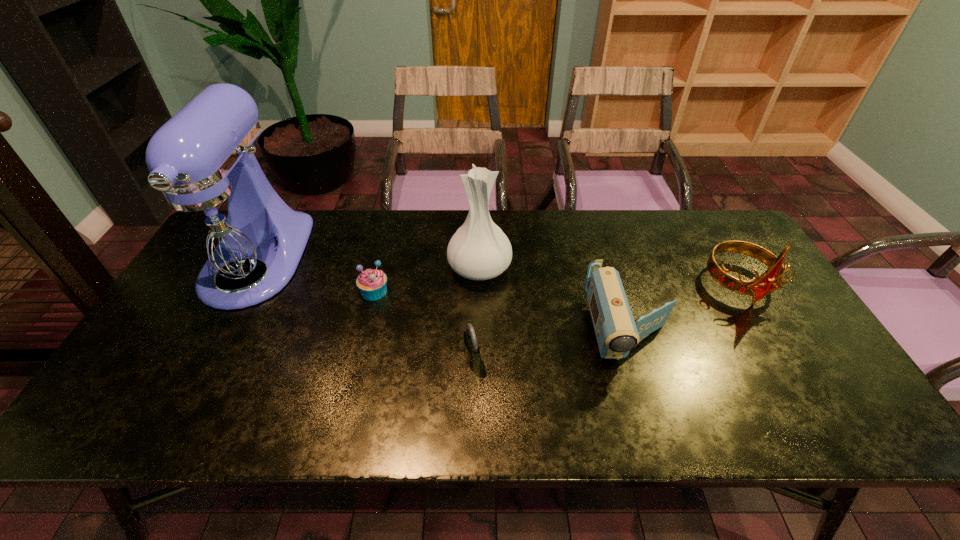
You are a GUI agent. You are given a task and a screenshot of the screen. Output one action in this format:
    pyautogui.click(x=<x>, y=<y>)
    Task: Click on the object that is at the far left corner
    The width and height of the screenshot is (960, 540).
    Given the screenshot: What is the action you would take?
    pyautogui.click(x=220, y=225)

Find the location of a particular element. This screenshot has width=960, height=540. vacant region at the far edge is located at coordinates (592, 232).

This screenshot has width=960, height=540. Identify the location of vacant space at the near edge of the desktop. (410, 421).

This screenshot has width=960, height=540. I want to click on vacant space at the far right corner of the desktop, so click(707, 246).

Where is `empty space that is in between the mixer and the second tallest object`? empty space that is in between the mixer and the second tallest object is located at coordinates (368, 265).

I want to click on vacant point located between the fifth shortest object and the leftmost object, so click(x=368, y=265).

This screenshot has width=960, height=540. I want to click on free space that is in between the shortest object and the vase, so click(427, 280).

Identify the location of free space between the muffin and the tallest object. (315, 276).

This screenshot has height=540, width=960. Find the location of `free area in between the mixer and the vase`. free area in between the mixer and the vase is located at coordinates (368, 265).

Locate an element on the screen. free spot between the tallest object and the third shortest object is located at coordinates (443, 296).